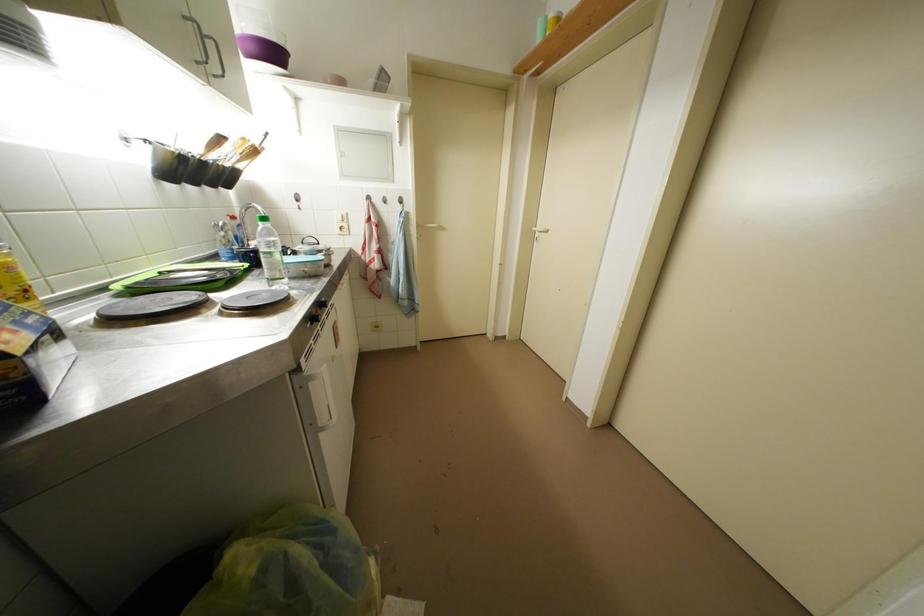
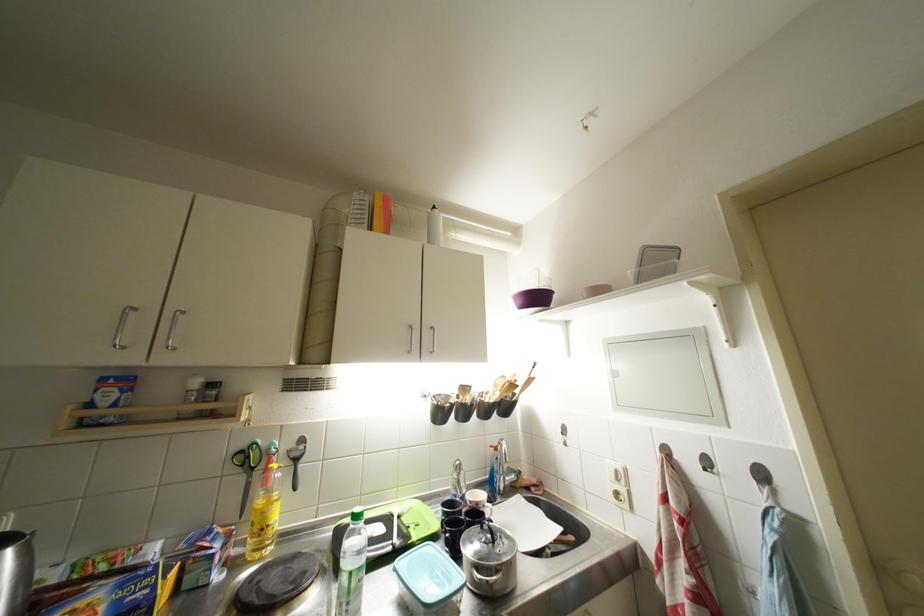
Find the pixel in the second image that matches the point at 407,205 in the first image.

(769, 479)